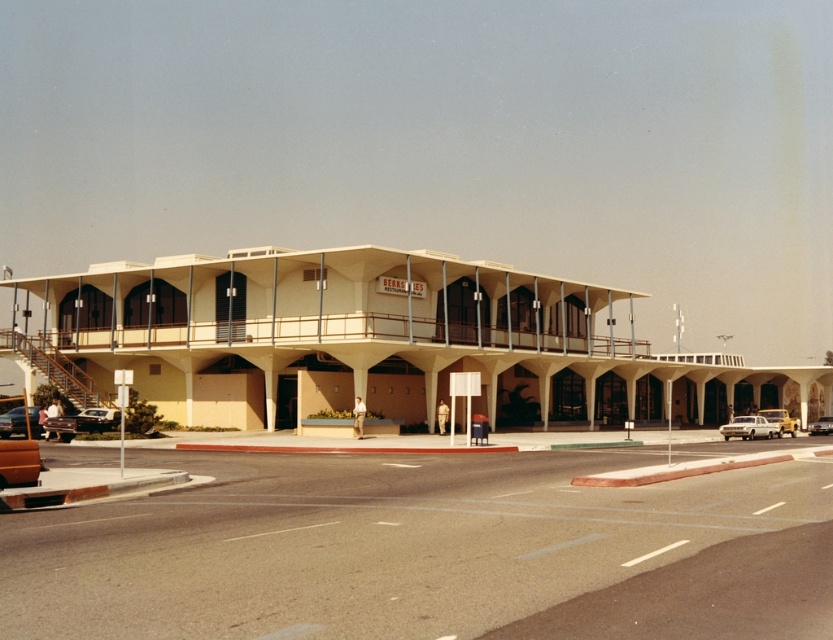
Who is taller, beige concrete motel at center or yellow metallic van at center?

beige concrete motel at center is taller.

Where is `beige concrete motel at center`? Image resolution: width=833 pixels, height=640 pixels. beige concrete motel at center is located at coordinates (370, 340).

Identify the location of beige concrete motel at center. The height and width of the screenshot is (640, 833). (370, 340).

Is shiny black sedan at lower left above yellow metallic van at center?

Correct, shiny black sedan at lower left is located above yellow metallic van at center.

Is shiny black sedan at lower left shorter than yellow metallic van at center?

Yes.

This screenshot has width=833, height=640. I want to click on shiny black sedan at lower left, so click(12, 422).

Identify the location of shiny black sedan at lower left. The height and width of the screenshot is (640, 833). (12, 422).

Can you confirm if shiny silver sedan at lower left is smaller than yellow metallic van at center?

Indeed, shiny silver sedan at lower left has a smaller size compared to yellow metallic van at center.

The width and height of the screenshot is (833, 640). What do you see at coordinates (82, 422) in the screenshot? I see `shiny silver sedan at lower left` at bounding box center [82, 422].

You are a GUI agent. You are given a task and a screenshot of the screen. Output one action in this format:
    pyautogui.click(x=<x>, y=<y>)
    Task: Click on the shiny silver sedan at lower left
    
    Given the screenshot: What is the action you would take?
    pyautogui.click(x=82, y=422)